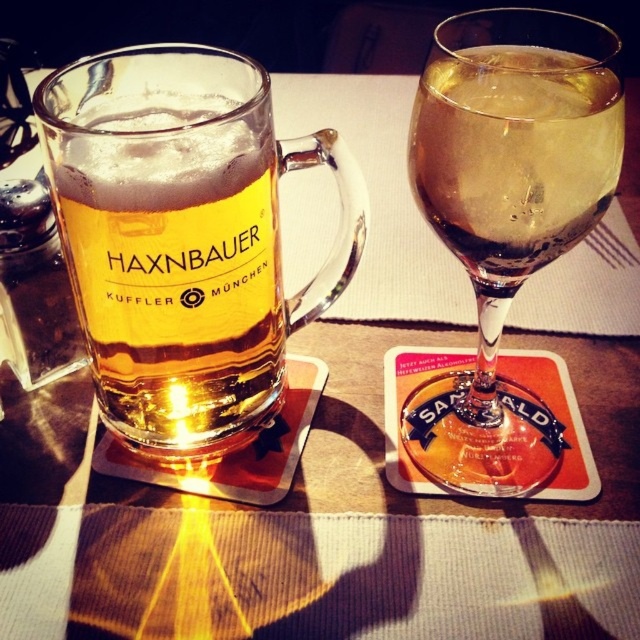
You are a bartender who needs to place a new drink order for the restaurant. The manager says the golden glass beer mug at left can hold 1.5 liters. Can the translucent glass at upper right hold the same amount of liquid?

The golden glass beer mug at left is larger in size than the translucent glass at upper right, so the translucent glass at upper right cannot hold 1.5 liters of liquid.

You are a bartender who needs to place a 7.5 inches tall bottle on the table. The bottle must be placed between the golden glass beer mug at left and the stemmed wine glass at right. Can you fit it there?

The golden glass beer mug at left is 6.97 inches from camera, so the distance between the two objects is not provided. Without knowing the distance between the two glasses, it is impossible to determine if the bottle will fit.